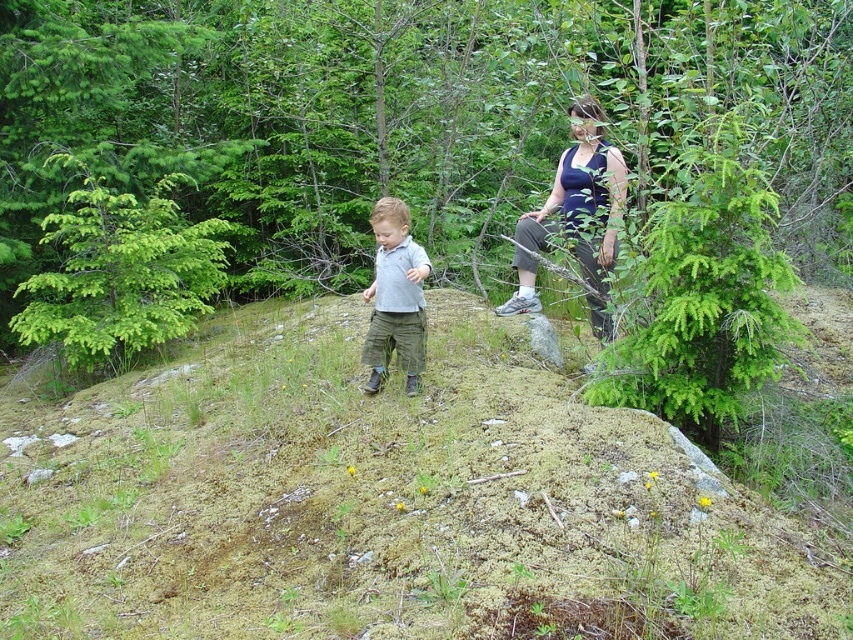
Question: Where is green mossy hillside at center located in relation to light gray cotton shirt at center in the image?

Choices:
 (A) above
 (B) below

Answer: (B)

Question: Among these points, which one is nearest to the camera?

Choices:
 (A) (107, 554)
 (B) (62, 28)
 (C) (379, 360)

Answer: (A)

Question: Is green leafy tree at center smaller than light gray cotton shirt at center?

Choices:
 (A) yes
 (B) no

Answer: (A)

Question: Is green leafy tree at center wider than dark blue tank top at upper right?

Choices:
 (A) yes
 (B) no

Answer: (B)

Question: Which object is the closest to the green leafy tree at center?

Choices:
 (A) light gray cotton shirt at center
 (B) green mossy hillside at center
 (C) dark blue tank top at upper right

Answer: (C)

Question: Which point is farther to the camera?

Choices:
 (A) light gray cotton shirt at center
 (B) green mossy hillside at center

Answer: (A)